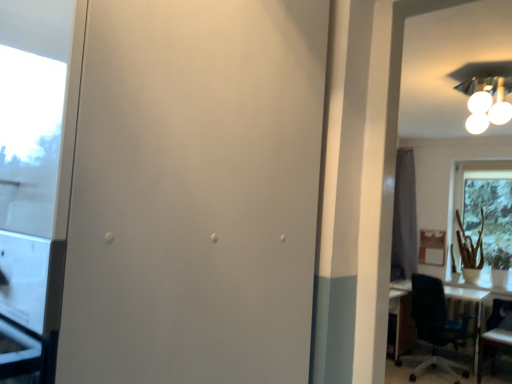
Question: Does transparent glass window at right turn towards black plastic chair at right, the first chair when ordered from left to right?

Choices:
 (A) yes
 (B) no

Answer: (A)

Question: From a real-world perspective, does transparent glass window at right sit lower than black plastic chair at right, the first chair when ordered from left to right?

Choices:
 (A) yes
 (B) no

Answer: (B)

Question: Is transparent glass window at right shorter than black plastic chair at right, the first chair when ordered from left to right?

Choices:
 (A) no
 (B) yes

Answer: (A)

Question: Is transparent glass window at right looking in the opposite direction of black plastic chair at right, the first chair when ordered from left to right?

Choices:
 (A) no
 (B) yes

Answer: (A)

Question: From the image's perspective, is transparent glass window at right located beneath black plastic chair at right, the first chair when ordered from left to right?

Choices:
 (A) yes
 (B) no

Answer: (B)

Question: In terms of size, does wooden chair at right, the first chair positioned from the right, appear bigger or smaller than white matte screen door at center?

Choices:
 (A) small
 (B) big

Answer: (A)

Question: Is point (482, 344) positioned closer to the camera than point (118, 231)?

Choices:
 (A) closer
 (B) farther

Answer: (B)

Question: Would you say wooden chair at right, arranged as the second chair when viewed from the left, is to the left or to the right of white matte screen door at center in the picture?

Choices:
 (A) right
 (B) left

Answer: (A)

Question: Choose the correct answer: Is wooden chair at right, arranged as the second chair when viewed from the left, inside white matte screen door at center or outside it?

Choices:
 (A) inside
 (B) outside

Answer: (B)

Question: Is black plastic chair at right, the first chair when ordered from left to right, taller or shorter than green matte plant at right?

Choices:
 (A) short
 (B) tall

Answer: (B)

Question: Relative to green matte plant at right, is black plastic chair at right, the second chair when ordered from right to left, in front or behind?

Choices:
 (A) front
 (B) behind

Answer: (A)

Question: From the image's perspective, is black plastic chair at right, the second chair when ordered from right to left, located above or below green matte plant at right?

Choices:
 (A) below
 (B) above

Answer: (A)

Question: In terms of width, does black plastic chair at right, the first chair when ordered from left to right, look wider or thinner when compared to green matte plant at right?

Choices:
 (A) wide
 (B) thin

Answer: (A)

Question: Considering the positions of point (468, 274) and point (414, 216), is point (468, 274) closer or farther from the camera than point (414, 216)?

Choices:
 (A) closer
 (B) farther

Answer: (A)

Question: Is green matte plant at right wider or thinner than gray fabric curtain at right?

Choices:
 (A) thin
 (B) wide

Answer: (B)